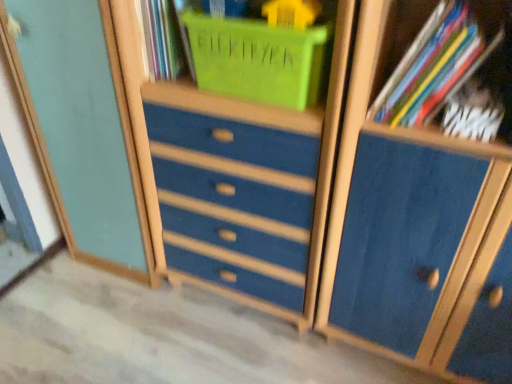
In order to face multicolored paper at upper right, which is the 1th book in top-to-bottom order, should I rotate leftwards or rightwards?

Turn right approximately 23.557 degrees to face it.

Identify the location of white matte book at upper right, which is counted as the second book, starting from the top. (473, 113).

At what (x,y) coordinates should I click in order to perform the action: click on matte blue cabinet at left. Please return your answer as a coordinate pair (x, y). This screenshot has height=384, width=512. Looking at the image, I should click on (83, 131).

Locate an element on the screen. This screenshot has height=384, width=512. blue painted wood dresser at center is located at coordinates (236, 169).

Is matte blue cabinet at left positioned with its back to multicolored paper at upper right, which is the 1th book in top-to-bottom order?

No, matte blue cabinet at left's orientation is not away from multicolored paper at upper right, which is the 1th book in top-to-bottom order.

From a real-world perspective, which object rests below the other?

In real-world perspective, matte blue cabinet at left is lower.

Which object is closer to the camera taking this photo, matte blue cabinet at left or multicolored paper at upper right, the second book in the bottom-to-top sequence?

Positioned in front is multicolored paper at upper right, the second book in the bottom-to-top sequence.

Is matte blue cabinet at left placed right next to multicolored paper at upper right, the second book in the bottom-to-top sequence?

No, matte blue cabinet at left is not beside multicolored paper at upper right, the second book in the bottom-to-top sequence.

Does matte blue cabinet at left touch white matte book at upper right, the 1th book from the bottom?

No, matte blue cabinet at left is not beside white matte book at upper right, the 1th book from the bottom.

Looking at this image, from a real-world perspective, is matte blue cabinet at left on top of white matte book at upper right, which is counted as the second book, starting from the top?

No, from a real-world perspective, matte blue cabinet at left is not above white matte book at upper right, which is counted as the second book, starting from the top.

Is matte blue cabinet at left surrounding white matte book at upper right, the 1th book from the bottom?

That's incorrect, white matte book at upper right, the 1th book from the bottom, is not inside matte blue cabinet at left.

Based on their positions, is blue matte cabinet at center located to the left or right of matte plastic basket at upper center?

Clearly, blue matte cabinet at center is on the right of matte plastic basket at upper center in the image.

Between point (453, 194) and point (264, 27), which one is positioned behind?

The point (453, 194) is farther from the camera.

From the image's perspective, is blue matte cabinet at center located beneath matte plastic basket at upper center?

Correct, blue matte cabinet at center appears lower than matte plastic basket at upper center in the image.

Does blue matte cabinet at center touch matte plastic basket at upper center?

blue matte cabinet at center is not next to matte plastic basket at upper center, and they're not touching.

Considering the relative sizes of blue painted wood dresser at center and blue matte cabinet at center in the image provided, is blue painted wood dresser at center taller than blue matte cabinet at center?

No.

Would you say blue painted wood dresser at center is a long distance from blue matte cabinet at center?

blue painted wood dresser at center is actually quite close to blue matte cabinet at center.

Is blue painted wood dresser at center completely or partially outside of blue matte cabinet at center?

Yes, blue painted wood dresser at center is located beyond the bounds of blue matte cabinet at center.

From a real-world perspective, which is physically above, blue painted wood dresser at center or blue matte cabinet at center?

blue matte cabinet at center is physically above.

Does matte blue cabinet at left touch matte plastic basket at upper center?

No, matte blue cabinet at left is not beside matte plastic basket at upper center.

Is matte blue cabinet at left facing towards matte plastic basket at upper center?

No.

Which point is more forward, (87, 100) or (289, 32)?

A: Point (289, 32)

Looking at this image, is multicolored paper at upper right, which is the 1th book in top-to-bottom order, with blue matte cabinet at center?

No, multicolored paper at upper right, which is the 1th book in top-to-bottom order, is not with blue matte cabinet at center.

In order to click on the 2nd book counting from the left of the blue matte cabinet at center in this screenshot , I will do `click(458, 66)`.

Is point (374, 109) positioned behind point (435, 136)?

Yes, it is behind point (435, 136).

Visually, is multicolored paper at upper right, the second book in the bottom-to-top sequence, positioned to the left or to the right of blue matte cabinet at center?

From the image, it's evident that multicolored paper at upper right, the second book in the bottom-to-top sequence, is to the left of blue matte cabinet at center.

From the image's perspective, who appears lower, blue matte cabinet at center or multicolored paper at upper right, the second book in the bottom-to-top sequence?

blue matte cabinet at center is shown below in the image.

Would you say blue matte cabinet at center is a long distance from multicolored paper at upper right, the second book in the bottom-to-top sequence?

That's not correct — blue matte cabinet at center is a little close to multicolored paper at upper right, the second book in the bottom-to-top sequence.

Is point (390, 159) farther from viewer compared to point (501, 34)?

No, (390, 159) is in front of (501, 34).

Can you tell me how much blue matte cabinet at center and multicolored paper at upper right, the second book in the bottom-to-top sequence, differ in facing direction?

blue matte cabinet at center and multicolored paper at upper right, the second book in the bottom-to-top sequence, are facing 0.255 degrees away from each other.

Identify the location of the 2nd book above the matte blue cabinet at left (from the image's perspective). (458, 66).

Identify the location of the 1st book in front of the matte blue cabinet at left, counting from the anchor's position. (473, 113).

Based on their spatial positions, is blue matte cabinet at center or multicolored paper at upper right, the second book in the bottom-to-top sequence, closer to white matte book at upper right, the 1th book from the bottom?

The object closer to white matte book at upper right, the 1th book from the bottom, is multicolored paper at upper right, the second book in the bottom-to-top sequence.

Based on their spatial positions, is matte plastic basket at upper center or white matte book at upper right, which is counted as the second book, starting from the top, closer to blue painted wood dresser at center?

matte plastic basket at upper center.

Which object lies further to the anchor point white matte book at upper right, the 1th book from the bottom, blue painted wood dresser at center or blue matte cabinet at center?

The object further to white matte book at upper right, the 1th book from the bottom, is blue painted wood dresser at center.

Based on their spatial positions, is blue painted wood dresser at center or white matte book at upper right, which is counted as the second book, starting from the top, closer to multicolored paper at upper right, the second book in the bottom-to-top sequence?

white matte book at upper right, which is counted as the second book, starting from the top, is positioned closer to the anchor multicolored paper at upper right, the second book in the bottom-to-top sequence.

Which object lies nearer to the anchor point blue matte cabinet at center, matte blue cabinet at left or matte plastic basket at upper center?

matte plastic basket at upper center is positioned closer to the anchor blue matte cabinet at center.

Looking at this image, which object lies nearer to the anchor point blue matte cabinet at center, multicolored paper at upper right, which is the 1th book in top-to-bottom order, or blue painted wood dresser at center?

Among the two, blue painted wood dresser at center is located nearer to blue matte cabinet at center.

From the picture: When comparing their distances from white matte book at upper right, which is counted as the second book, starting from the top, does matte blue cabinet at left or multicolored paper at upper right, the second book in the bottom-to-top sequence, seem further?

matte blue cabinet at left.

Consider the image. Based on their spatial positions, is blue matte cabinet at center or matte plastic basket at upper center further from matte blue cabinet at left?

Based on the image, blue matte cabinet at center appears to be further to matte blue cabinet at left.

Where is `basket located between blue painted wood dresser at center and white matte book at upper right, which is counted as the second book, starting from the top, in the left-right direction`? Image resolution: width=512 pixels, height=384 pixels. basket located between blue painted wood dresser at center and white matte book at upper right, which is counted as the second book, starting from the top, in the left-right direction is located at coordinates (257, 59).

You are a GUI agent. You are given a task and a screenshot of the screen. Output one action in this format:
    pyautogui.click(x=<x>, y=<y>)
    Task: Click on the book between multicolored paper at upper right, which is the 1th book in top-to-bottom order, and blue matte cabinet at center, in the vertical direction
    The height and width of the screenshot is (384, 512).
    Given the screenshot: What is the action you would take?
    pyautogui.click(x=473, y=113)

The width and height of the screenshot is (512, 384). Identify the location of basket between matte blue cabinet at left and white matte book at upper right, the 1th book from the bottom, from left to right. (257, 59).

Where is `dresser situated between matte blue cabinet at left and blue matte cabinet at center from left to right`? dresser situated between matte blue cabinet at left and blue matte cabinet at center from left to right is located at coordinates (236, 169).